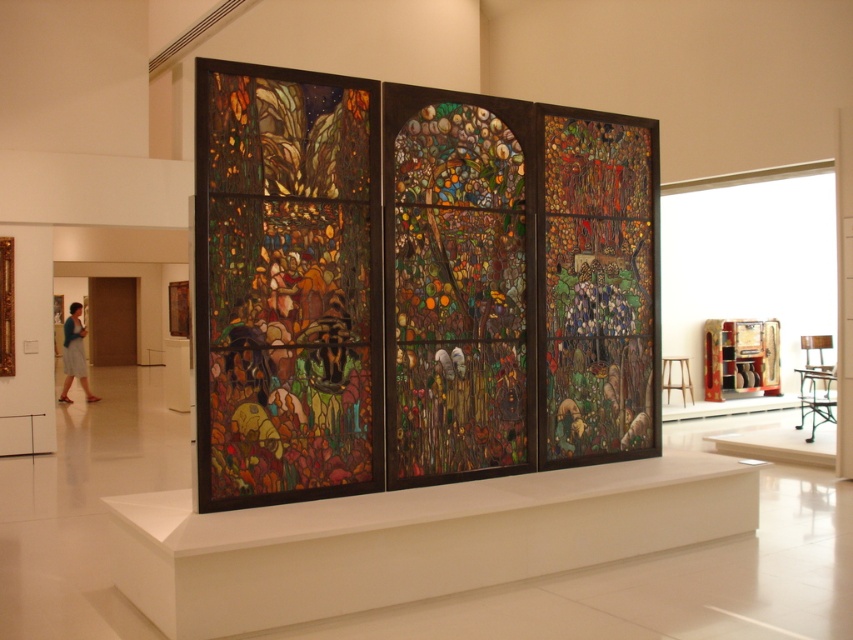
Question: Among these objects, which one is nearest to the camera?

Choices:
 (A) stained glass window at center
 (B) stained glass at center
 (C) blue denim skirt at left

Answer: (B)

Question: Is stained glass window at center thinner than blue denim skirt at left?

Choices:
 (A) no
 (B) yes

Answer: (B)

Question: Is stained glass window at center closer to camera compared to blue denim skirt at left?

Choices:
 (A) yes
 (B) no

Answer: (A)

Question: Which object appears farthest from the camera in this image?

Choices:
 (A) stained glass window at center
 (B) stained glass at center

Answer: (A)

Question: Can you confirm if stained glass window at center is positioned to the left of blue denim skirt at left?

Choices:
 (A) no
 (B) yes

Answer: (A)

Question: Which point is closer to the camera taking this photo?

Choices:
 (A) (84, 392)
 (B) (440, 276)
 (C) (494, 394)

Answer: (B)